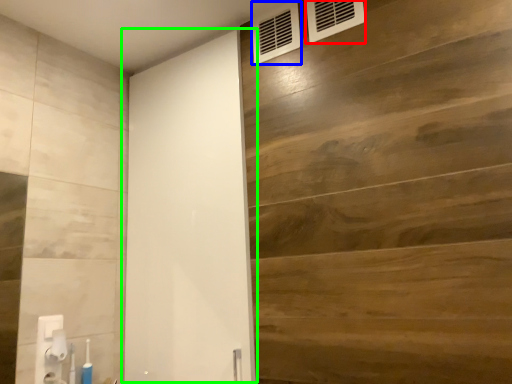
Question: Estimate the real-world distances between objects in this image. Which object is farther from air conditioning (highlighted by a red box), air conditioning (highlighted by a blue box) or barn door (highlighted by a green box)?

Choices:
 (A) air conditioning
 (B) barn door

Answer: (B)